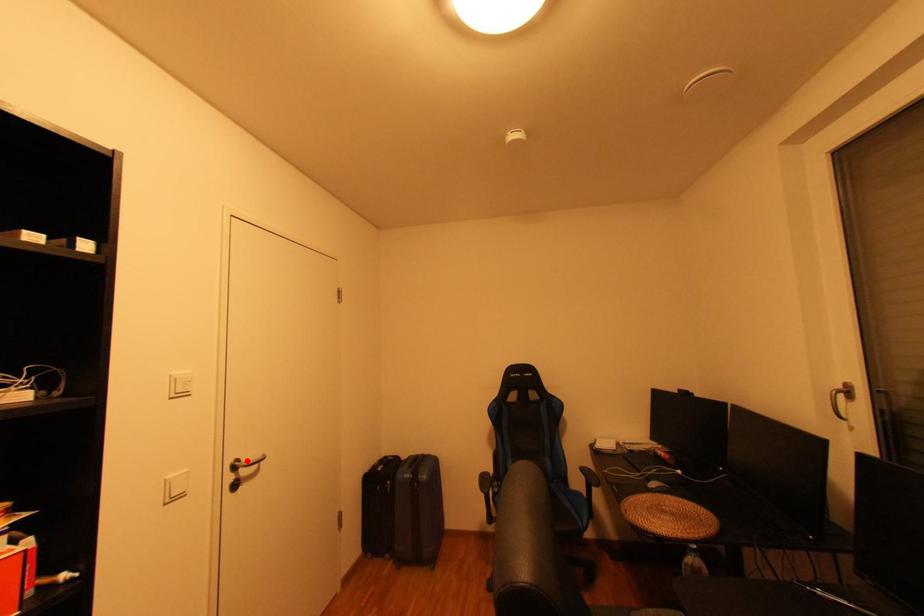
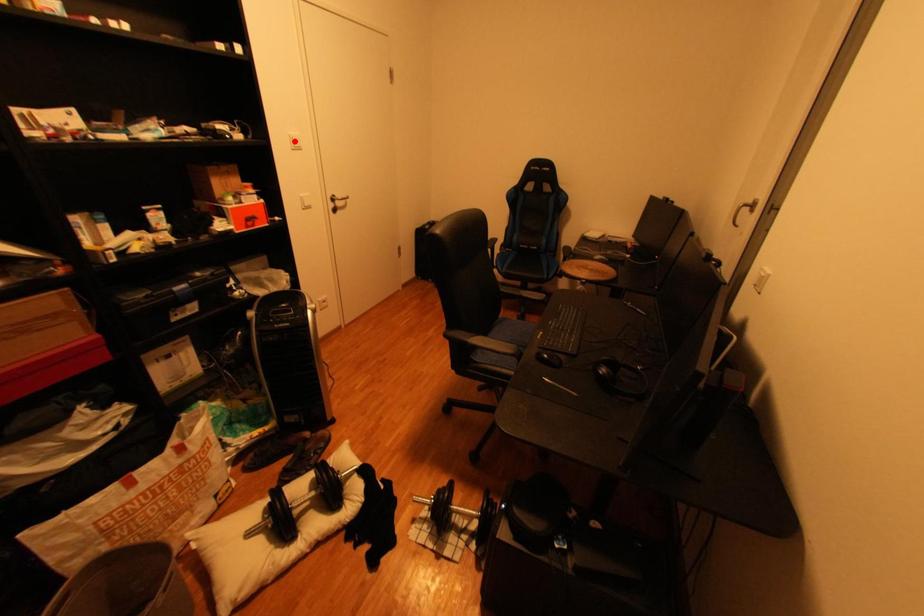
I am providing you with two images of the same scene from different viewpoints. A red point is marked on the first image and another point is marked on the second image. Is the marked point in image1 the same physical position as the marked point in image2?

No